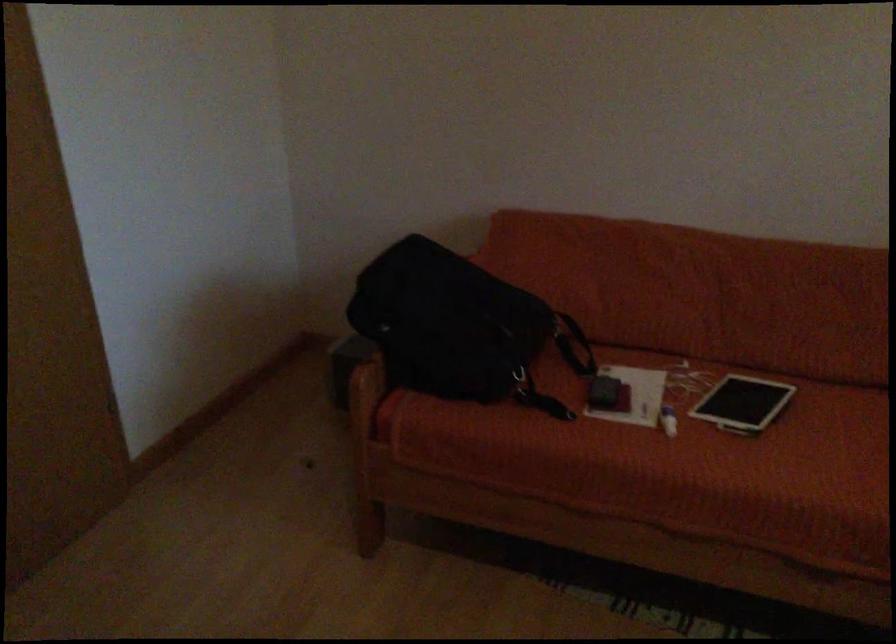
You are a GUI agent. You are given a task and a screenshot of the screen. Output one action in this format:
    pyautogui.click(x=<x>, y=<y>)
    Task: Click on the small white bottle
    
    Given the screenshot: What is the action you would take?
    pyautogui.click(x=668, y=420)